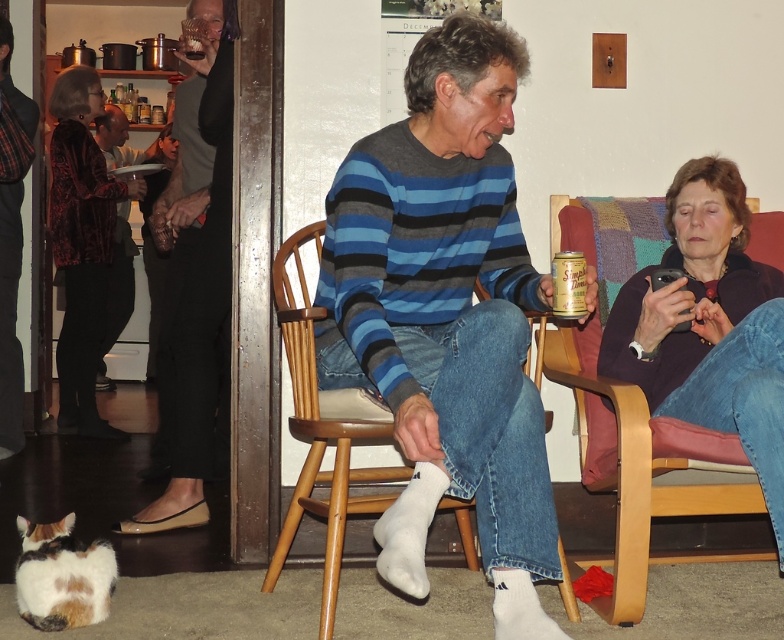
You are standing in the room and want to hand a gift to the person wearing the purple soft sweater at right and the shiny black shoes at lower left. Which one can you reach without moving from your current position?

The purple soft sweater at right is closer to the viewer than the shiny black shoes at lower left, so you can reach the person wearing the purple soft sweater at right without moving.